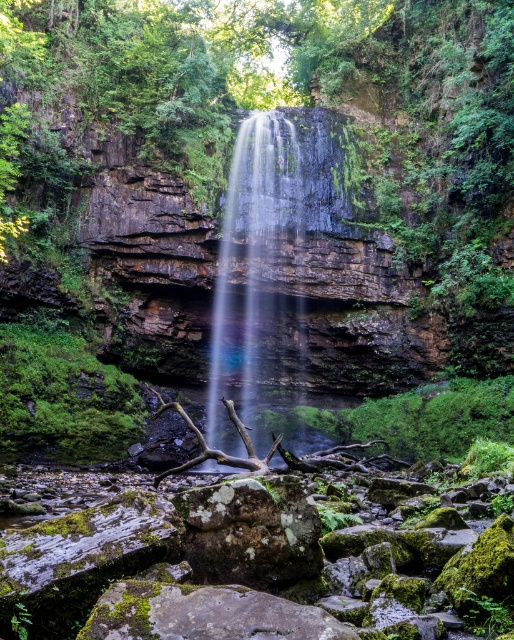
You are standing at the center of the image. Where exactly is the translucent glass waterfall at center located?

The translucent glass waterfall at center is located at point coordinates of (251, 262).

You are standing at the base of the waterfall and want to reach a hidden treasure located at point (x=292, y=193). There is an obstacle at point (x=449, y=532) blocking your path. Can you safely navigate around the obstacle to reach the treasure without getting too close to the waterfall?

Point (x=449, y=532) is in front of point (x=292, y=193), so the obstacle is between you and the treasure. You will need to find an alternative path around the obstacle to reach the treasure safely without approaching the waterfall closely.

You are a hiker who wants to cross the river at the base of the waterfall. You see the mossy rock at center and the translucent glass waterfall at center. Which object is shorter and can be used as a stepping stone?

The mossy rock at center is not as tall as the translucent glass waterfall at center, so the mossy rock at center is shorter and can be used as a stepping stone.